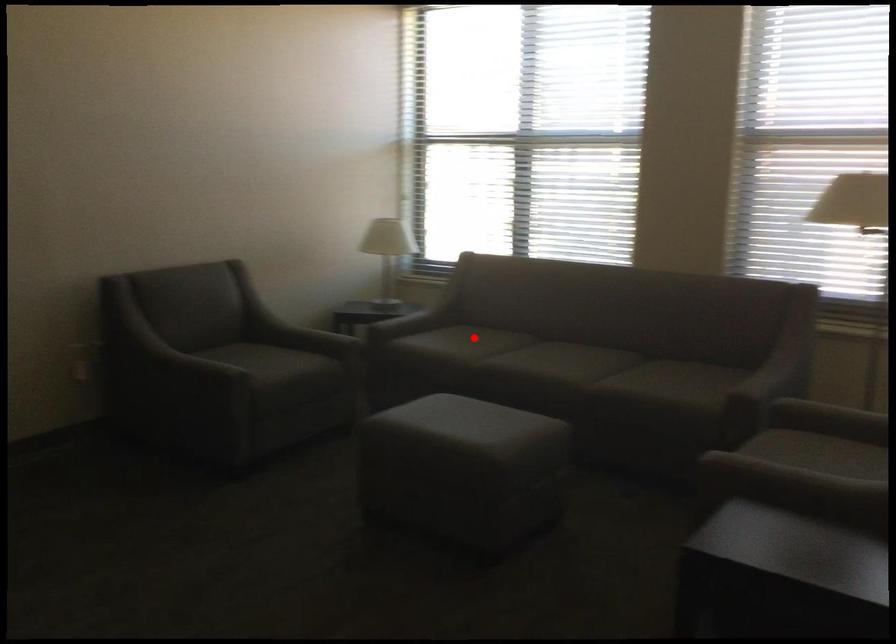
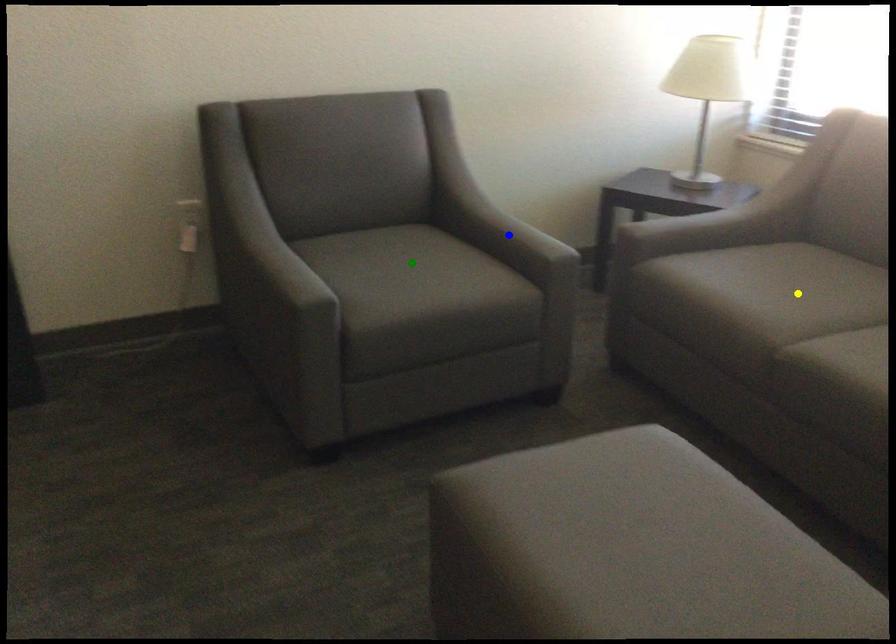
Question: I am providing you with two images of the same scene from different viewpoints. A red point is marked on the first image. You are given multiple points on the second image. Which mark in image 2 goes with the point in image 1?

Choices:
 (A) yellow point
 (B) blue point
 (C) green point

Answer: (A)